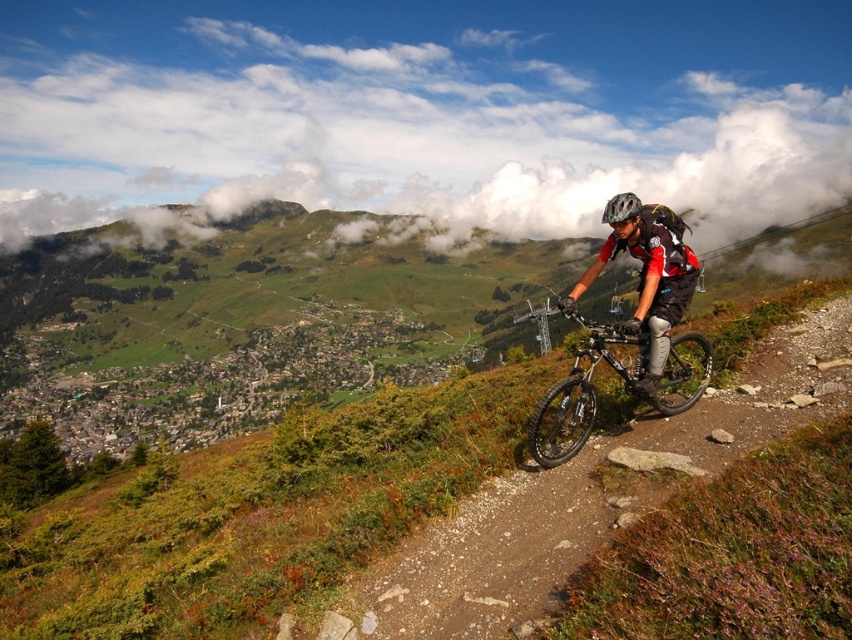
Question: Based on their relative distances, which object is farther from the white fluffy cloud at upper center?

Choices:
 (A) shiny black frame at right
 (B) black matte helmet at upper center
 (C) dirt/gravel path at center-right

Answer: (B)

Question: Among these points, which one is farthest from the camera?

Choices:
 (A) (540, 458)
 (B) (422, 120)
 (C) (747, 442)

Answer: (B)

Question: Is dirt/gravel path at center-right closer to camera compared to shiny black helmet at upper right?

Choices:
 (A) no
 (B) yes

Answer: (B)

Question: Estimate the real-world distances between objects in this image. Which object is closer to the shiny black helmet at upper right?

Choices:
 (A) white fluffy cloud at upper center
 (B) dirt/gravel path at center-right
 (C) black matte helmet at upper center
 (D) shiny black frame at right

Answer: (B)

Question: Is shiny black frame at right below black matte helmet at upper center?

Choices:
 (A) yes
 (B) no

Answer: (A)

Question: Is the position of shiny black helmet at upper right less distant than that of black matte helmet at upper center?

Choices:
 (A) yes
 (B) no

Answer: (A)